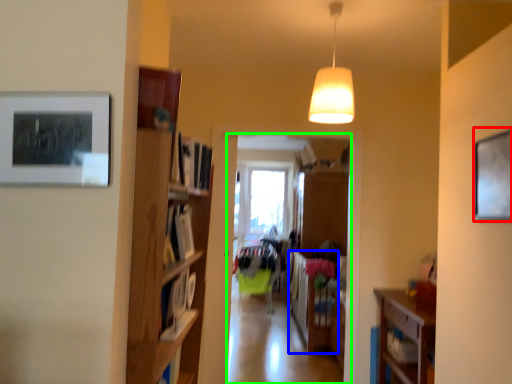
Question: Estimate the real-world distances between objects in this image. Which object is farther from picture frame (highlighted by a red box), table (highlighted by a blue box) or clothing store (highlighted by a green box)?

Choices:
 (A) table
 (B) clothing store

Answer: (B)